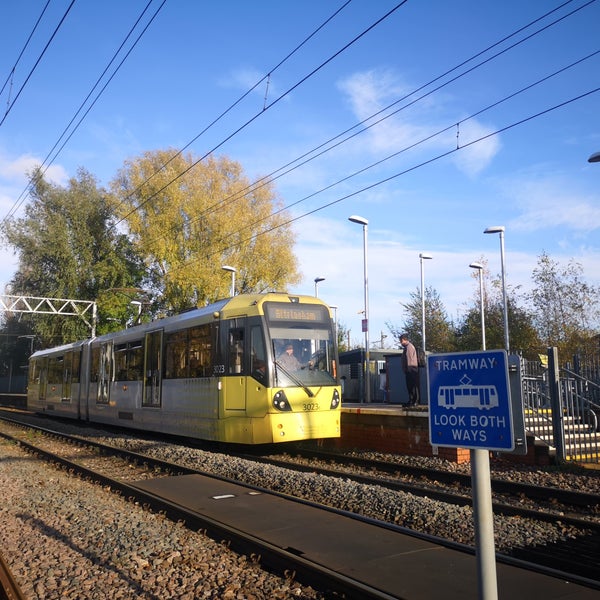
Locate an element on the screen. This screenshot has height=600, width=600. stairs is located at coordinates (585, 435).